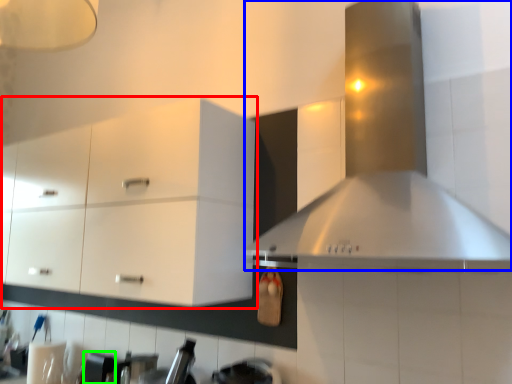
Question: Estimate the real-world distances between objects in this image. Which object is closer to cabinetry (highlighted by a red box), vent (highlighted by a blue box) or appliance (highlighted by a green box)?

Choices:
 (A) vent
 (B) appliance

Answer: (A)